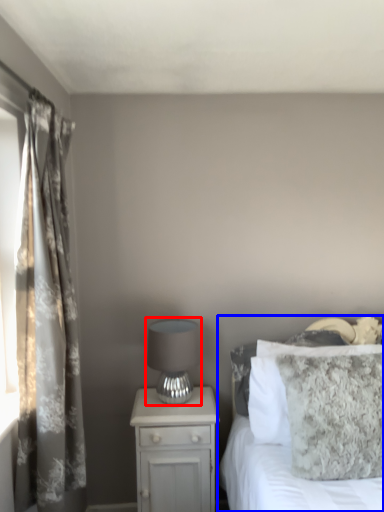
Question: Which of the following is the farthest to the observer, table lamp (highlighted by a red box) or bed (highlighted by a blue box)?

Choices:
 (A) table lamp
 (B) bed

Answer: (A)